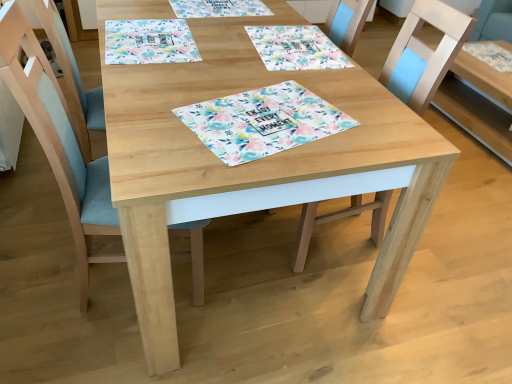
Question: In which direction should I rotate to look at natural wood table at center, which appears as the first table when viewed from the left?

Choices:
 (A) right
 (B) left

Answer: (B)

Question: Considering the relative positions of natural wood table at center, which appears as the first table when viewed from the left, and wooden chair at center, acting as the 2th chair starting from the left, in the image provided, is natural wood table at center, which appears as the first table when viewed from the left, to the left of wooden chair at center, acting as the 2th chair starting from the left, from the viewer's perspective?

Choices:
 (A) yes
 (B) no

Answer: (A)

Question: From the image's perspective, is natural wood table at center, which is the second table in right-to-left order, on wooden chair at center, which appears as the 1th chair when viewed from the right?

Choices:
 (A) no
 (B) yes

Answer: (B)

Question: Does natural wood table at center, which appears as the first table when viewed from the left, have a smaller size compared to wooden chair at center, which appears as the 1th chair when viewed from the right?

Choices:
 (A) no
 (B) yes

Answer: (A)

Question: Considering the relative sizes of natural wood table at center, which is the second table in right-to-left order, and wooden chair at center, acting as the 2th chair starting from the left, in the image provided, is natural wood table at center, which is the second table in right-to-left order, thinner than wooden chair at center, acting as the 2th chair starting from the left,?

Choices:
 (A) yes
 (B) no

Answer: (B)

Question: Is natural wood table at center, which appears as the first table when viewed from the left, wider than wooden chair at center, which appears as the 1th chair when viewed from the right?

Choices:
 (A) yes
 (B) no

Answer: (A)

Question: Does natural wood table at center, which appears as the first table when viewed from the left, lie behind wooden chair at center, acting as the 2th chair starting from the left?

Choices:
 (A) no
 (B) yes

Answer: (A)

Question: From a real-world perspective, is natural wood table at right, acting as the second table starting from the left, positioned over floral paper placemat at center based on gravity?

Choices:
 (A) no
 (B) yes

Answer: (A)

Question: Can you confirm if natural wood table at right, acting as the second table starting from the left, is taller than floral paper placemat at center?

Choices:
 (A) no
 (B) yes

Answer: (B)

Question: Considering the relative positions of natural wood table at right, acting as the second table starting from the left, and floral paper placemat at center in the image provided, is natural wood table at right, acting as the second table starting from the left, to the left of floral paper placemat at center from the viewer's perspective?

Choices:
 (A) yes
 (B) no

Answer: (B)

Question: Is natural wood table at right, which is counted as the first table, starting from the right, outside floral paper placemat at center?

Choices:
 (A) no
 (B) yes

Answer: (B)

Question: From the image's perspective, would you say natural wood table at right, acting as the second table starting from the left, is shown under floral paper placemat at center?

Choices:
 (A) yes
 (B) no

Answer: (B)

Question: Is floral paper placemat at center inside natural wood table at right, which is counted as the first table, starting from the right?

Choices:
 (A) yes
 (B) no

Answer: (B)

Question: Can you confirm if floral paper placemat at center is smaller than floral fabric placemat at upper center?

Choices:
 (A) no
 (B) yes

Answer: (B)